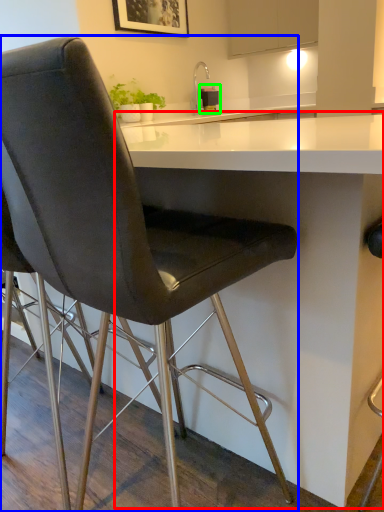
Question: Based on their relative distances, which object is farther from table (highlighted by a red box)? Choose from chair (highlighted by a blue box) and appliance (highlighted by a green box).

Choices:
 (A) chair
 (B) appliance

Answer: (B)